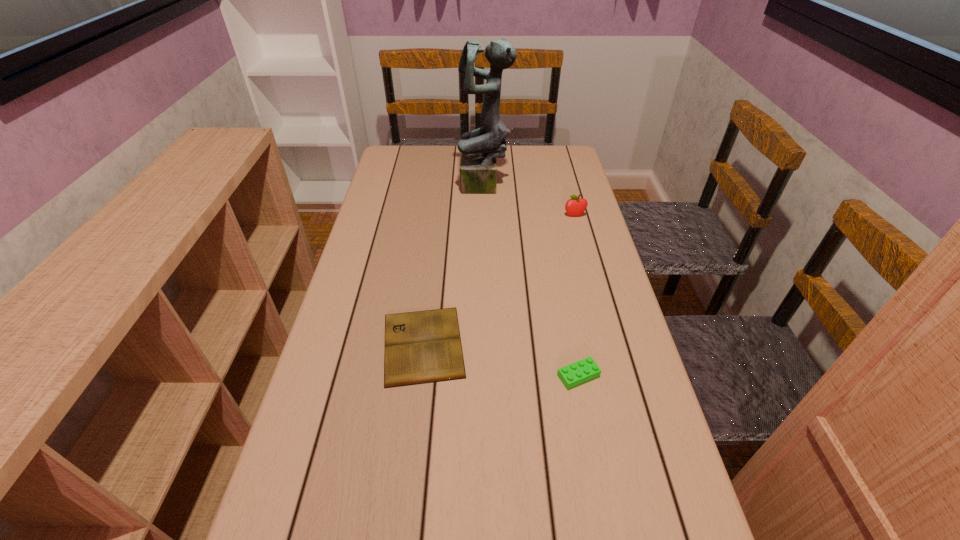
The width and height of the screenshot is (960, 540). I want to click on free space between the second shortest object and the book, so click(x=501, y=360).

Image resolution: width=960 pixels, height=540 pixels. I want to click on unoccupied area between the sculpture and the second farthest object, so click(x=530, y=201).

Identify the location of vacant area that lies between the book and the tallest object. This screenshot has height=540, width=960. tap(454, 266).

The width and height of the screenshot is (960, 540). What are the coordinates of `free space between the rightmost object and the shortest object` in the screenshot? It's located at (499, 280).

Where is `free space between the apple and the third object from left to right`? The height and width of the screenshot is (540, 960). free space between the apple and the third object from left to right is located at coordinates (577, 295).

At what (x,y) coordinates should I click in order to perform the action: click on blank region between the Lego and the shortest object. Please return your answer as a coordinate pair (x, y). This screenshot has width=960, height=540. Looking at the image, I should click on (501, 360).

At what (x,y) coordinates should I click in order to perform the action: click on empty space between the book and the sculpture. Please return your answer as a coordinate pair (x, y). Image resolution: width=960 pixels, height=540 pixels. Looking at the image, I should click on (454, 266).

Identify the location of blank region between the tallest object and the second object from right to left. [x=532, y=281].

The image size is (960, 540). Identify the location of blank region between the shortest object and the rightmost object. (499, 280).

I want to click on object that stands as the third closest to the rightmost object, so click(x=584, y=370).